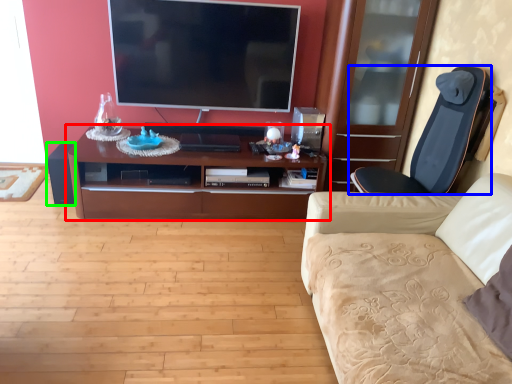
Question: Estimate the real-world distances between objects in this image. Which object is farther from cabinetry (highlighted by a red box), chair (highlighted by a blue box) or speaker (highlighted by a green box)?

Choices:
 (A) chair
 (B) speaker

Answer: (A)